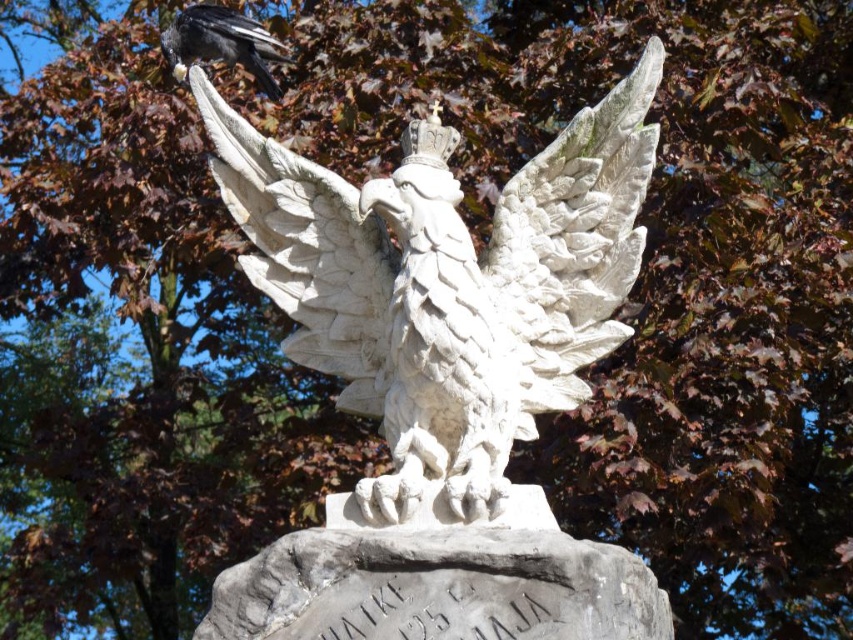
Can you confirm if white stone eagle at center is shorter than shiny black raven at upper left?

No, white stone eagle at center is not shorter than shiny black raven at upper left.

Is white stone eagle at center to the right of shiny black raven at upper left from the viewer's perspective?

Indeed, white stone eagle at center is positioned on the right side of shiny black raven at upper left.

Image resolution: width=853 pixels, height=640 pixels. Describe the element at coordinates (447, 282) in the screenshot. I see `white stone eagle at center` at that location.

Locate an element on the screen. The width and height of the screenshot is (853, 640). white stone eagle at center is located at coordinates (447, 282).